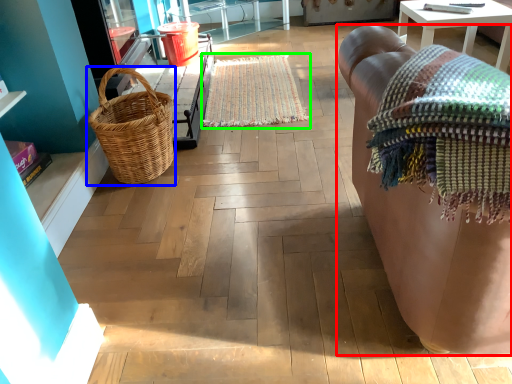
Question: Which is farther away from studio couch (highlighted by a red box)? picnic basket (highlighted by a blue box) or mat (highlighted by a green box)?

Choices:
 (A) picnic basket
 (B) mat

Answer: (B)